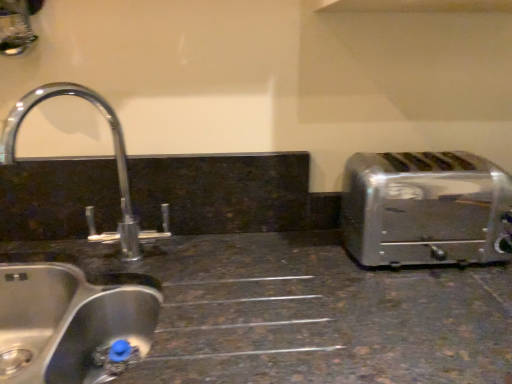
Question: Does point (32, 347) appear closer or farther from the camera than point (342, 230)?

Choices:
 (A) closer
 (B) farther

Answer: (A)

Question: Considering the positions of brushed metal sink at left, which is the first sink in top-to-bottom order, and satin silver toaster at right in the image, is brushed metal sink at left, which is the first sink in top-to-bottom order, wider or thinner than satin silver toaster at right?

Choices:
 (A) thin
 (B) wide

Answer: (A)

Question: Which object is the closest to the stainless steel sink at lower left, which is the first sink in bottom-to-top order?

Choices:
 (A) satin silver toaster at right
 (B) brushed metal sink at left, which is the first sink in top-to-bottom order

Answer: (B)

Question: Which object is the farthest from the stainless steel sink at lower left, which is the first sink in bottom-to-top order?

Choices:
 (A) brushed metal sink at left, arranged as the 2th sink when ordered from the bottom
 (B) satin silver toaster at right

Answer: (B)